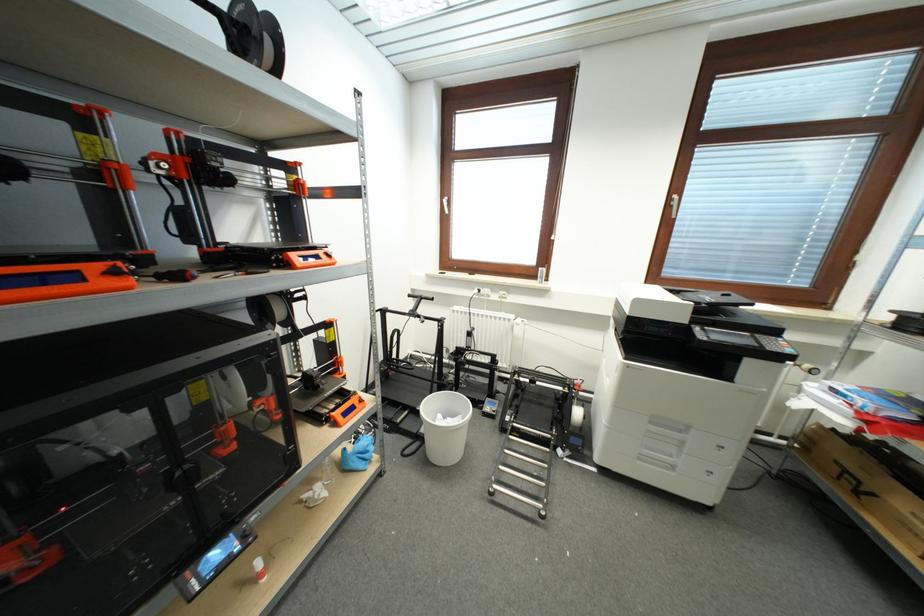
Identify the location of black handle screwdriver. (168, 273).